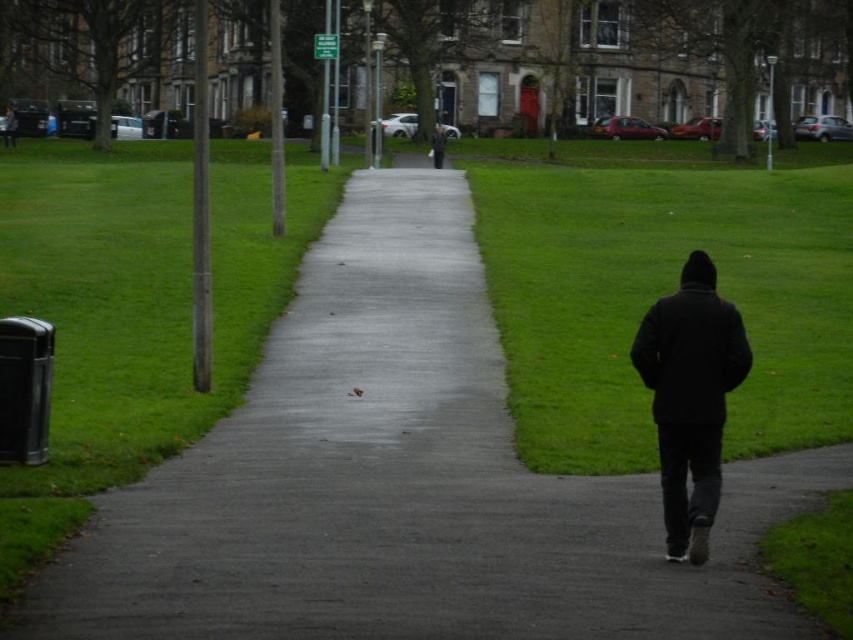
Question: Does green grass at center have a lesser width compared to black matte jacket at lower right?

Choices:
 (A) yes
 (B) no

Answer: (B)

Question: Does green grass at left lie in front of black matte jacket at lower right?

Choices:
 (A) yes
 (B) no

Answer: (A)

Question: Where is concrete at center located in relation to black matte jacket at center in the image?

Choices:
 (A) above
 (B) below

Answer: (B)

Question: Which point is closer to the camera?

Choices:
 (A) concrete at center
 (B) green grass at center

Answer: (A)

Question: Which of these objects is positioned closest to the black matte jacket at center?

Choices:
 (A) concrete at center
 (B) green grass at center

Answer: (B)

Question: Among these points, which one is nearest to the camera?

Choices:
 (A) (596, 486)
 (B) (515, 221)
 (C) (711, 435)
 (D) (184, 387)

Answer: (C)